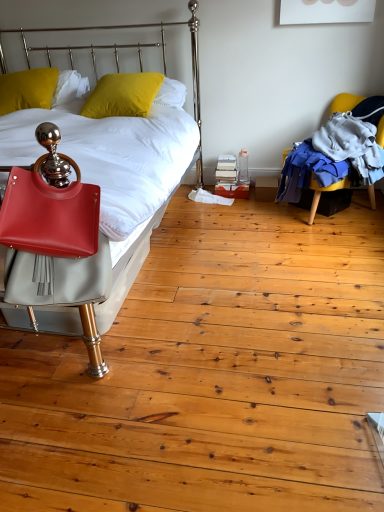
Question: Is yellow fabric chair at right directly adjacent to matte leather bed at left?

Choices:
 (A) no
 (B) yes

Answer: (A)

Question: Is yellow fabric chair at right at the right side of matte leather bed at left?

Choices:
 (A) no
 (B) yes

Answer: (B)

Question: Is yellow fabric chair at right looking in the opposite direction of matte leather bed at left?

Choices:
 (A) yes
 (B) no

Answer: (B)

Question: From the image's perspective, is yellow fabric chair at right over matte leather bed at left?

Choices:
 (A) no
 (B) yes

Answer: (B)

Question: Does yellow fabric chair at right have a larger size compared to matte leather bed at left?

Choices:
 (A) no
 (B) yes

Answer: (A)

Question: From a real-world perspective, relative to yellow fabric chair at right, is yellow matte pillow at upper left, which is counted as the 1th pillow, starting from the left, vertically above or below?

Choices:
 (A) above
 (B) below

Answer: (A)

Question: Based on their positions, is yellow matte pillow at upper left, which is counted as the 1th pillow, starting from the left, located to the left or right of yellow fabric chair at right?

Choices:
 (A) right
 (B) left

Answer: (B)

Question: Is yellow matte pillow at upper left, which is counted as the 1th pillow, starting from the left, inside or outside of yellow fabric chair at right?

Choices:
 (A) outside
 (B) inside

Answer: (A)

Question: Is yellow matte pillow at upper left, which is the second pillow in right-to-left order, in front of or behind yellow fabric chair at right in the image?

Choices:
 (A) behind
 (B) front

Answer: (A)

Question: From a real-world perspective, is matte leather bed at left physically located above or below yellow matte pillow at upper left, which is the first pillow in right-to-left order?

Choices:
 (A) above
 (B) below

Answer: (B)

Question: Considering the positions of matte leather bed at left and yellow matte pillow at upper left, which is the first pillow in right-to-left order, in the image, is matte leather bed at left wider or thinner than yellow matte pillow at upper left, which is the first pillow in right-to-left order,?

Choices:
 (A) thin
 (B) wide

Answer: (B)

Question: Is matte leather bed at left inside or outside of yellow matte pillow at upper left, the 2th pillow viewed from the left?

Choices:
 (A) inside
 (B) outside

Answer: (B)

Question: Is point (99, 368) positioned closer to the camera than point (139, 108)?

Choices:
 (A) farther
 (B) closer

Answer: (B)

Question: Is point (125, 100) positioned closer to the camera than point (82, 186)?

Choices:
 (A) closer
 (B) farther

Answer: (B)

Question: Is yellow matte pillow at upper left, which is the first pillow in right-to-left order, in front of or behind matte leather bed at left in the image?

Choices:
 (A) front
 (B) behind

Answer: (B)